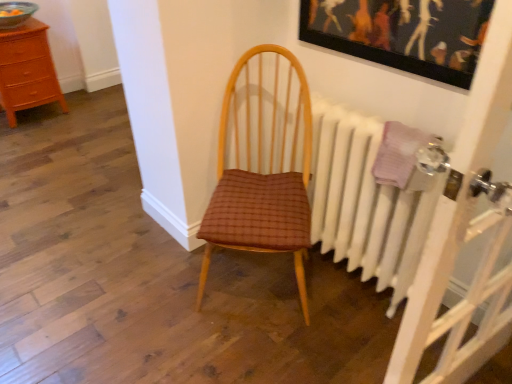
This screenshot has width=512, height=384. Find the location of `free space in front of white painted radiator at right`. free space in front of white painted radiator at right is located at coordinates (337, 334).